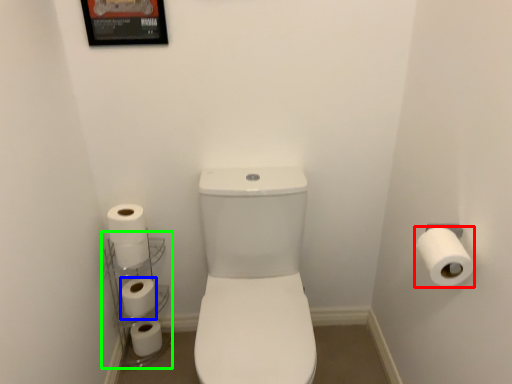
Question: Based on their relative distances, which object is nearer to toilet paper (highlighted by a red box)? Choose from toilet paper (highlighted by a blue box) and shelf (highlighted by a green box).

Choices:
 (A) toilet paper
 (B) shelf

Answer: (A)